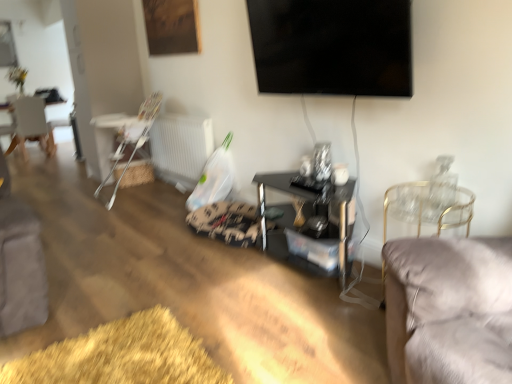
Question: Is the position of white plastic radiator at lower center more distant than that of white plastic highchair at left, the 2th chair viewed from the front?

Choices:
 (A) yes
 (B) no

Answer: (A)

Question: From a real-world perspective, is white plastic radiator at lower center on top of white plastic highchair at left, which appears as the second chair when viewed from the right?

Choices:
 (A) yes
 (B) no

Answer: (B)

Question: From the image's perspective, is white plastic radiator at lower center on top of white plastic highchair at left, which is the 2th chair in left-to-right order?

Choices:
 (A) yes
 (B) no

Answer: (B)

Question: Is the surface of white plastic radiator at lower center in direct contact with white plastic highchair at left, which is the 2th chair in left-to-right order?

Choices:
 (A) yes
 (B) no

Answer: (B)

Question: Could you tell me if white plastic radiator at lower center is turned towards white plastic highchair at left, which appears as the second chair when viewed from the right?

Choices:
 (A) yes
 (B) no

Answer: (A)

Question: Considering the positions of point (387, 208) and point (122, 132), is point (387, 208) closer or farther from the camera than point (122, 132)?

Choices:
 (A) closer
 (B) farther

Answer: (A)

Question: Considering the positions of velvet grey chair at right, marked as the 3th chair in a left-to-right arrangement, and white plastic highchair at left, which is the second chair from back to front, in the image, is velvet grey chair at right, marked as the 3th chair in a left-to-right arrangement, bigger or smaller than white plastic highchair at left, which is the second chair from back to front,?

Choices:
 (A) small
 (B) big

Answer: (A)

Question: From the image's perspective, is velvet grey chair at right, which is counted as the third chair, starting from the back, above or below white plastic highchair at left, which is the second chair from back to front?

Choices:
 (A) below
 (B) above

Answer: (A)

Question: Is velvet grey chair at right, the first chair from the front, wider or thinner than white plastic highchair at left, the 2th chair viewed from the front?

Choices:
 (A) thin
 (B) wide

Answer: (A)

Question: Looking at the image, does white plastic highchair at left, the 2th chair viewed from the front, seem bigger or smaller compared to velvet grey chair at right, which ranks as the first chair in right-to-left order?

Choices:
 (A) big
 (B) small

Answer: (A)

Question: Visually, is white plastic highchair at left, which is the 2th chair in left-to-right order, positioned to the left or to the right of velvet grey chair at right, which is counted as the third chair, starting from the back?

Choices:
 (A) left
 (B) right

Answer: (A)

Question: From a real-world perspective, relative to velvet grey chair at right, which ranks as the first chair in right-to-left order, is white plastic highchair at left, the 2th chair viewed from the front, vertically above or below?

Choices:
 (A) above
 (B) below

Answer: (A)

Question: Is white plastic highchair at left, which is the 2th chair in left-to-right order, taller or shorter than velvet grey chair at right, which ranks as the first chair in right-to-left order?

Choices:
 (A) tall
 (B) short

Answer: (A)

Question: Is white wooden chair at left, the 1th chair in the back-to-front sequence, bigger or smaller than velvet grey chair at right, marked as the 3th chair in a left-to-right arrangement?

Choices:
 (A) small
 (B) big

Answer: (B)

Question: From the image's perspective, relative to velvet grey chair at right, which is counted as the third chair, starting from the back, is white wooden chair at left, the 1th chair viewed from the left, above or below?

Choices:
 (A) below
 (B) above

Answer: (B)